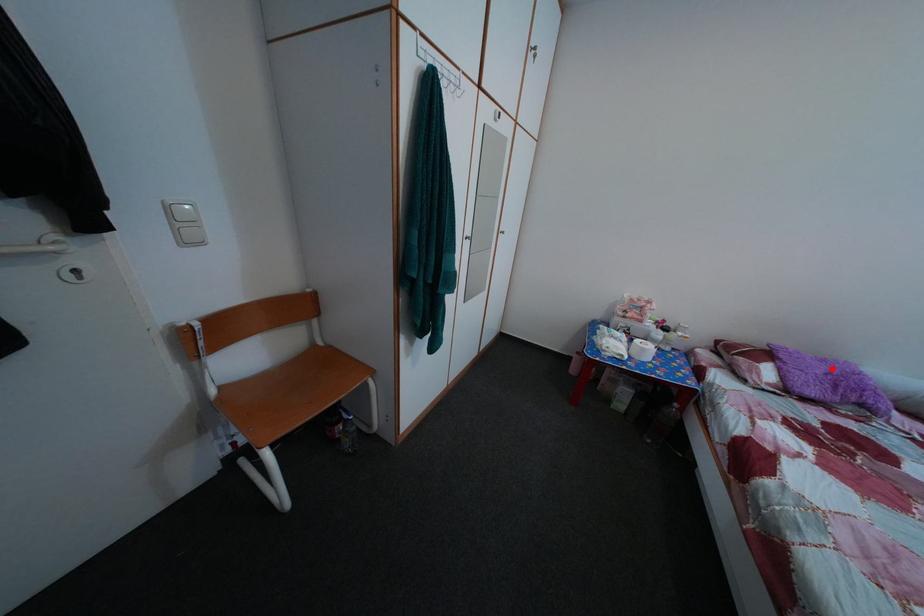
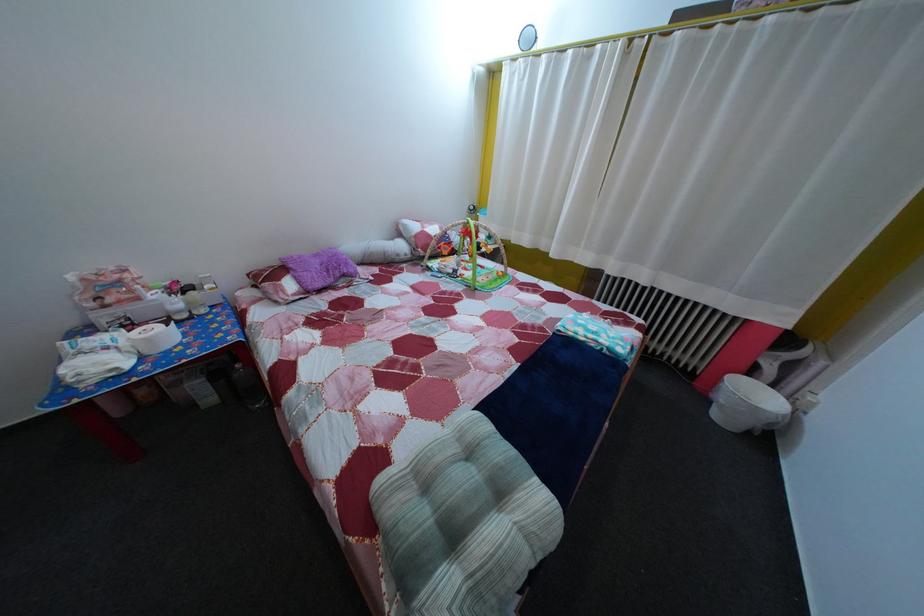
Question: A red point is marked in image1. In image2, is the corresponding 3D point closer to the camera or farther? Reply with the corresponding letter.

Choices:
 (A) The corresponding 3D point is closer.
 (B) The corresponding 3D point is farther.

Answer: (A)